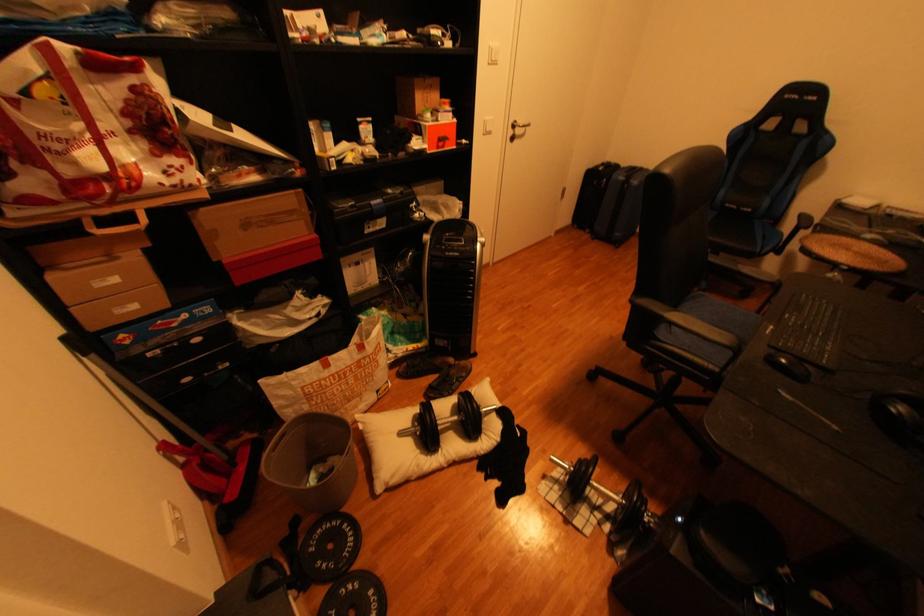
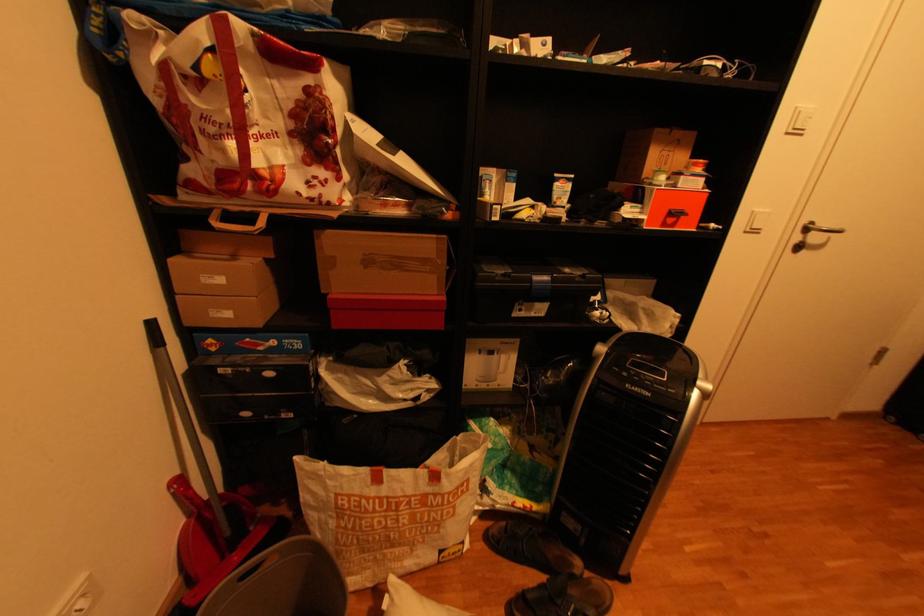
Question: The camera is either moving clockwise (left) or counter-clockwise (right) around the object. The first image is from the beginning of the video and the second image is from the end. Is the camera moving left or right when shooting the video?

Choices:
 (A) Left
 (B) Right

Answer: (B)